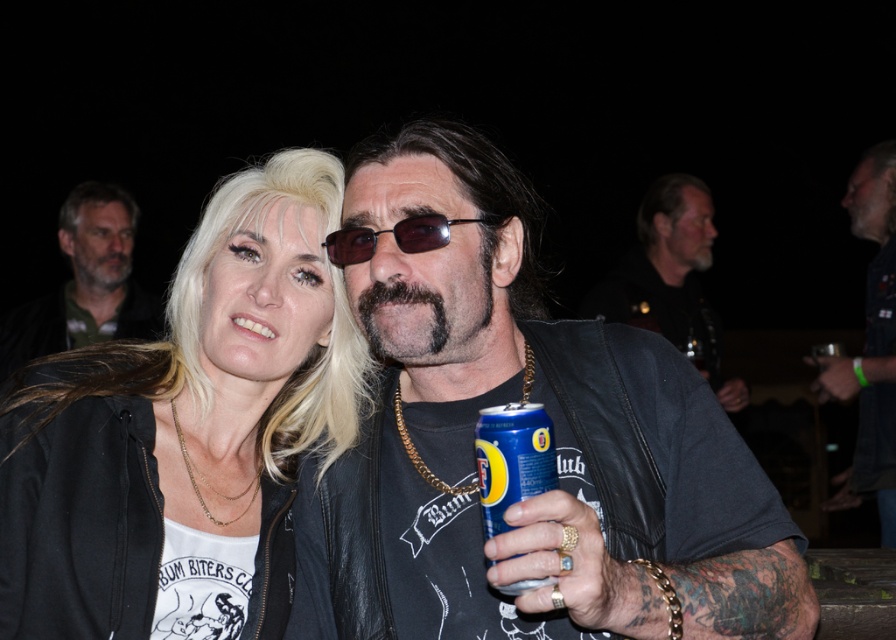
Question: Which object is positioned closest to the leather jacket at center?

Choices:
 (A) sunglasses at center
 (B) blue metallic can at center
 (C) dark brown leather jacket at right

Answer: (B)

Question: Observing the image, what is the correct spatial positioning of dark brown leather jacket at upper left in reference to blue metallic can at center?

Choices:
 (A) left
 (B) right

Answer: (A)

Question: Is dark brown leather jacket at upper left smaller than blue metallic can at center?

Choices:
 (A) no
 (B) yes

Answer: (A)

Question: Which point is farther to the camera?

Choices:
 (A) dark brown leather jacket at right
 (B) sunglasses at center

Answer: (A)

Question: Does leather jacket at center have a greater width compared to sunglasses at center?

Choices:
 (A) no
 (B) yes

Answer: (B)

Question: Which point is closer to the camera?

Choices:
 (A) (59, 300)
 (B) (713, 353)
 (C) (96, 390)
 (D) (886, 371)

Answer: (C)